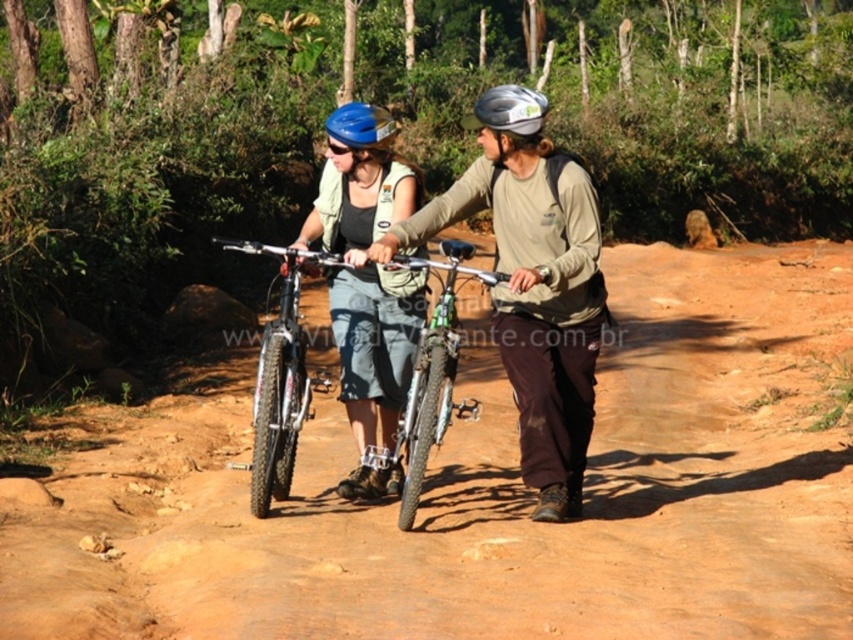
Question: Does matte black bicycle at center appear under blue matte goggles at center?

Choices:
 (A) yes
 (B) no

Answer: (A)

Question: Can you confirm if matte black bicycle at center is positioned above blue matte goggles at center?

Choices:
 (A) no
 (B) yes

Answer: (A)

Question: Which of the following is the closest to the observer?

Choices:
 (A) (363, 445)
 (B) (329, 138)

Answer: (B)

Question: Based on their relative distances, which object is farther from the brown dirt track at center?

Choices:
 (A) shiny metallic bicycle at center
 (B) blue matte bicycle helmet at center
 (C) shiny black frame at center

Answer: (B)

Question: Considering the relative positions of brown dirt track at center and shiny black frame at center in the image provided, where is brown dirt track at center located with respect to shiny black frame at center?

Choices:
 (A) left
 (B) right

Answer: (B)

Question: Which point is farther from the camera taking this photo?

Choices:
 (A) (498, 125)
 (B) (386, 156)

Answer: (B)